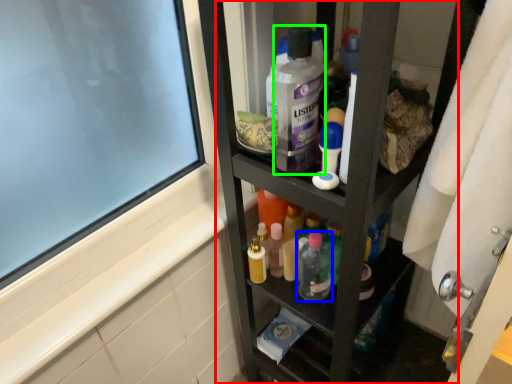
Question: Estimate the real-world distances between objects in this image. Which object is closer to cabinet (highlighted by a red box), toiletry (highlighted by a blue box) or cleaning product (highlighted by a green box)?

Choices:
 (A) toiletry
 (B) cleaning product

Answer: (A)